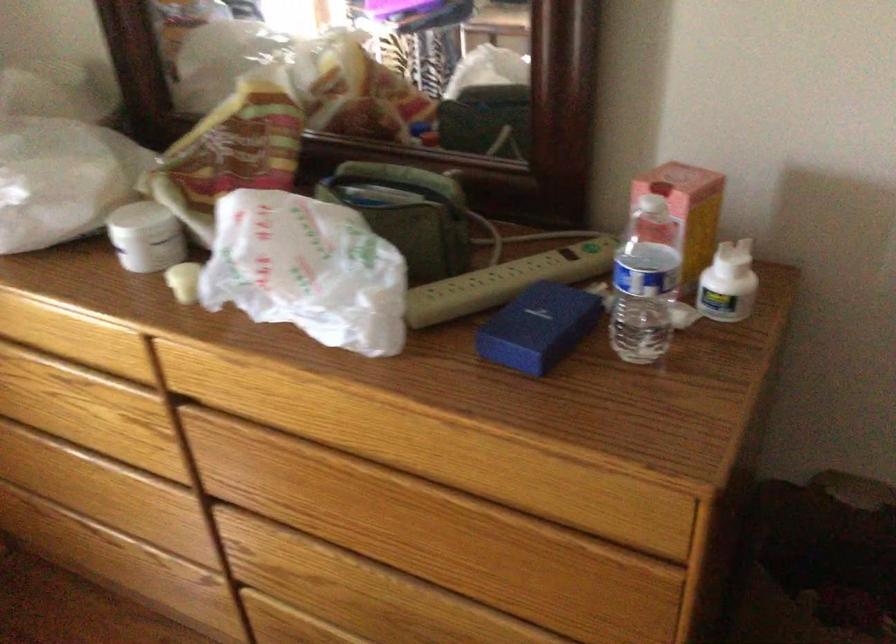
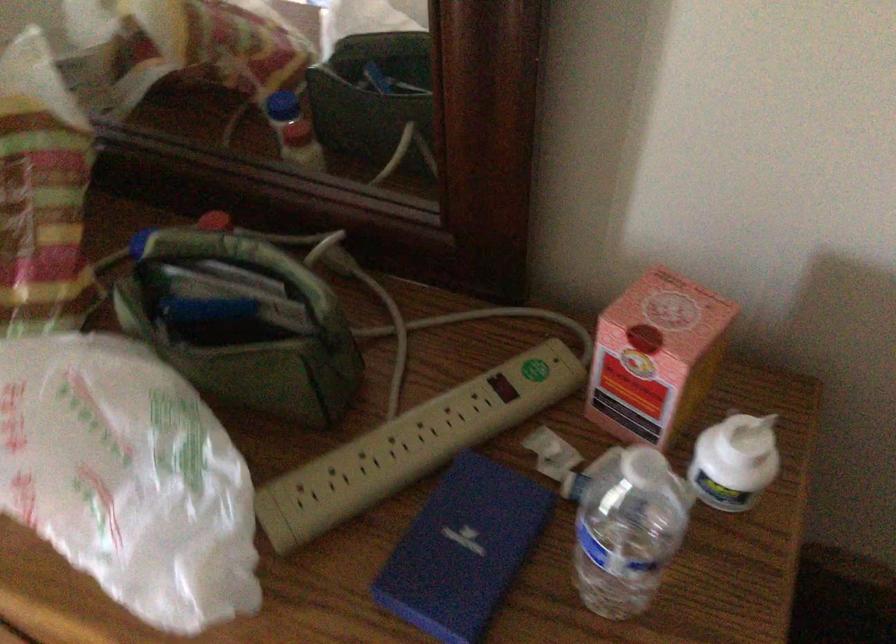
Question: Which direction would the cameraman need to move to produce the second image? Reply with the corresponding letter.

Choices:
 (A) Left
 (B) Right
 (C) Forward
 (D) Backward

Answer: (C)